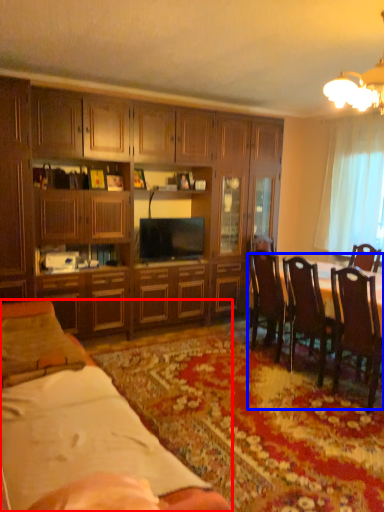
Question: Which object is further to the camera taking this photo, desk (highlighted by a red box) or kitchen & dining room table (highlighted by a blue box)?

Choices:
 (A) desk
 (B) kitchen & dining room table

Answer: (B)